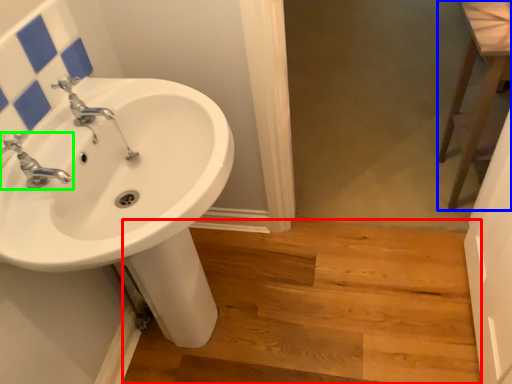
Question: Based on their relative distances, which object is farther from stairwell (highlighted by a red box)? Choose from level (highlighted by a blue box) and tap (highlighted by a green box).

Choices:
 (A) level
 (B) tap

Answer: (B)